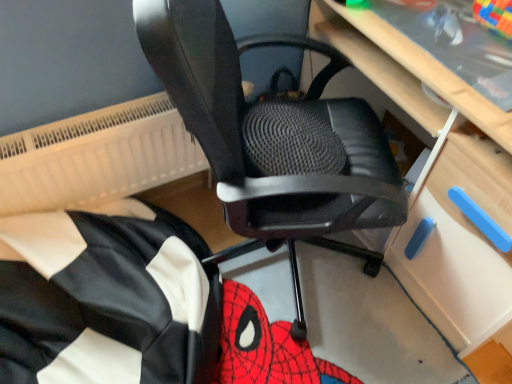
The height and width of the screenshot is (384, 512). Identify the location of vacant area on top of white textured radiator at upper left (from a real-world perspective). tap(76, 128).